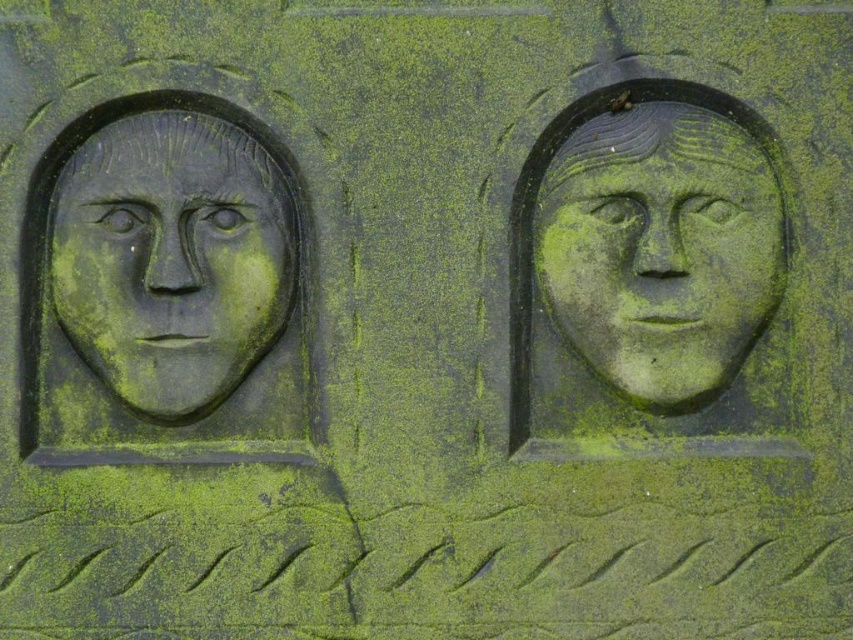
Question: Among these points, which one is nearest to the camera?

Choices:
 (A) (614, 332)
 (B) (132, 330)

Answer: (B)

Question: Which point appears farthest from the camera in this image?

Choices:
 (A) click(x=280, y=328)
 (B) click(x=607, y=262)

Answer: (A)

Question: Can you confirm if matte stone face at upper right is positioned to the right of matte stone face at left?

Choices:
 (A) no
 (B) yes

Answer: (B)

Question: Can you confirm if matte stone face at upper right is positioned to the right of matte stone face at left?

Choices:
 (A) no
 (B) yes

Answer: (B)

Question: Does matte stone face at upper right appear under matte stone face at left?

Choices:
 (A) no
 (B) yes

Answer: (A)